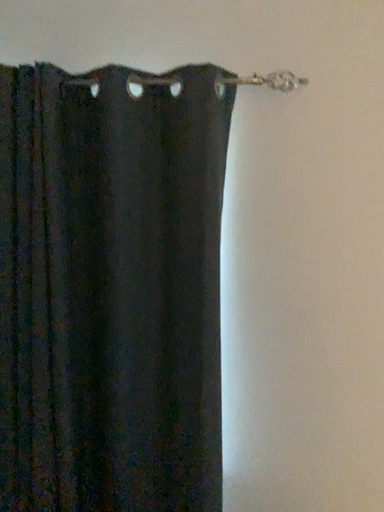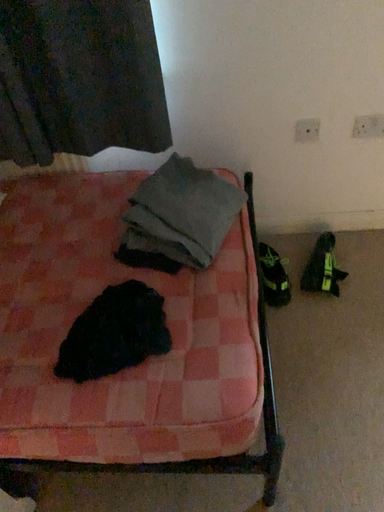
Question: How did the camera likely rotate when shooting the video?

Choices:
 (A) rotated downward
 (B) rotated upward

Answer: (A)